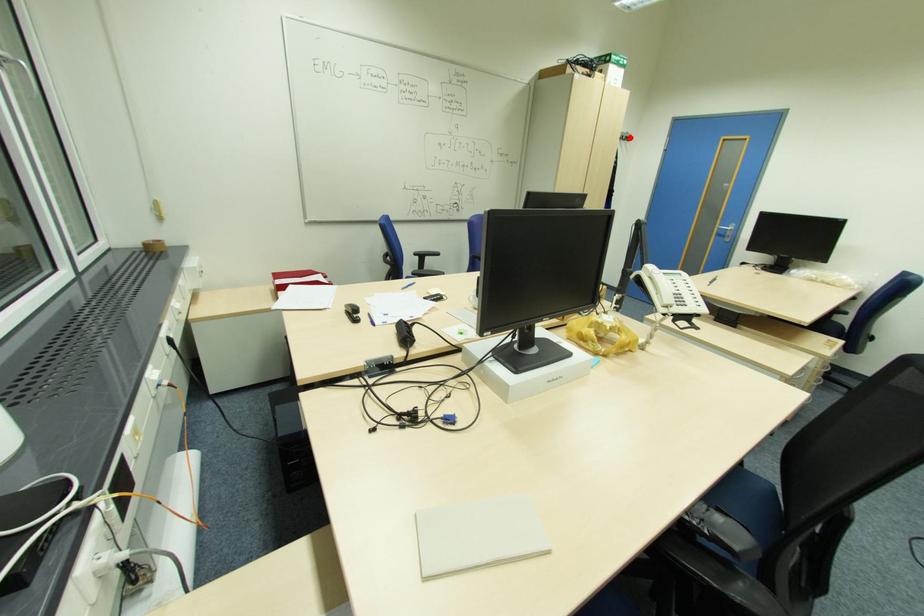
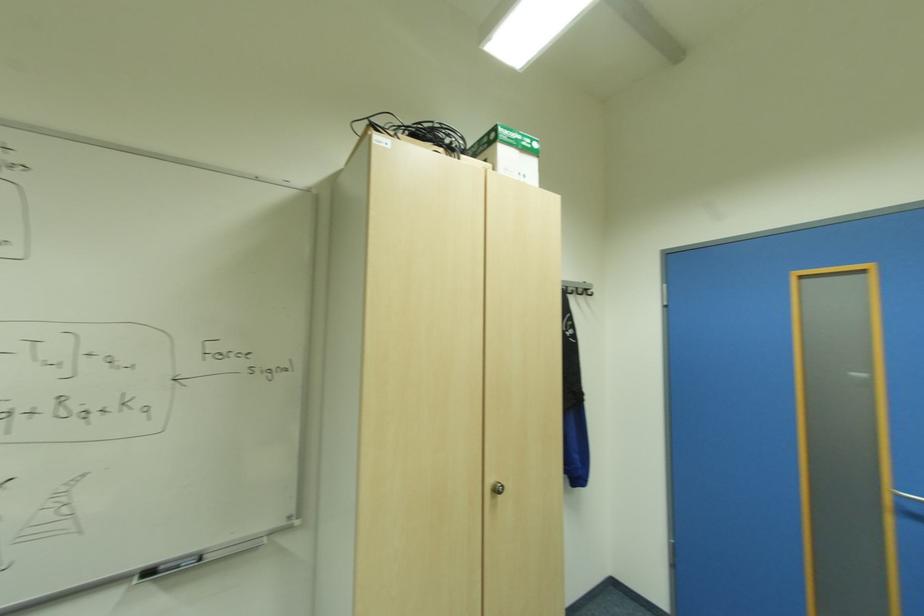
Question: I am providing you with two images of the same scene from different viewpoints. In image1, a red point is highlighted. Considering the same 3D point in image2, which of the following is correct?

Choices:
 (A) It is closer
 (B) It is farther

Answer: (B)